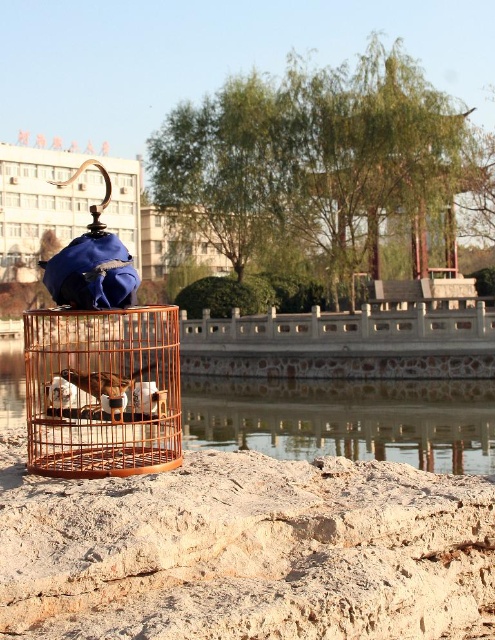
Does brown wooden birdcage at center appear under transparent glass water at center?

Actually, brown wooden birdcage at center is above transparent glass water at center.

Does brown wooden birdcage at center have a lesser height compared to transparent glass water at center?

In fact, brown wooden birdcage at center may be taller than transparent glass water at center.

The image size is (495, 640). In order to click on brown wooden birdcage at center in this screenshot , I will do `click(100, 364)`.

Where is `brown wooden birdcage at center`? brown wooden birdcage at center is located at coordinates (100, 364).

Can you confirm if brown wooden birdcage at center is positioned below white feathered bird at center?

Correct, brown wooden birdcage at center is located below white feathered bird at center.

In the scene shown: Between brown wooden birdcage at center and white feathered bird at center, which one has more height?

Standing taller between the two is brown wooden birdcage at center.

Identify the location of brown wooden birdcage at center. This screenshot has height=640, width=495. (100, 364).

Can you confirm if transparent glass water at center is smaller than white feathered bird at center?

Actually, transparent glass water at center might be larger than white feathered bird at center.

Between point (304, 403) and point (84, 376), which one is positioned behind?

The point (304, 403) is more distant.

The width and height of the screenshot is (495, 640). I want to click on transparent glass water at center, so click(346, 422).